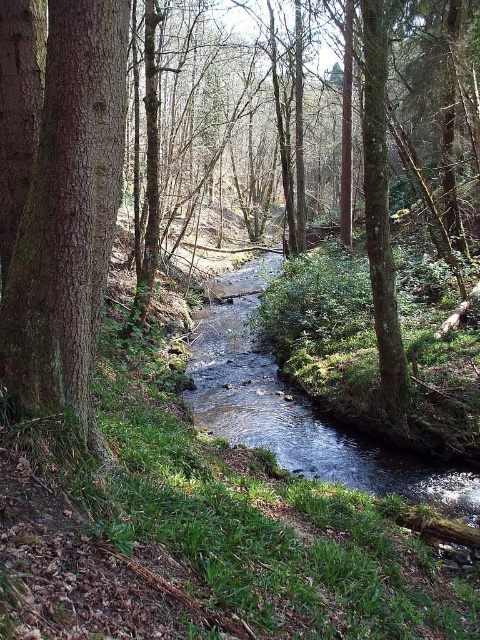
Does smooth brown tree trunk at left lie in front of clear water at center?

Yes, smooth brown tree trunk at left is in front of clear water at center.

Can you confirm if smooth brown tree trunk at left is bigger than clear water at center?

No, smooth brown tree trunk at left is not bigger than clear water at center.

Which is behind, point (84, 196) or point (261, 417)?

Point (261, 417)

Where is `smooth brown tree trunk at left`? The width and height of the screenshot is (480, 640). smooth brown tree trunk at left is located at coordinates (68, 216).

Is brown rough tree at center further to camera compared to smooth brown tree trunk at left?

Yes, it is.

Locate an element on the screen. brown rough tree at center is located at coordinates (62, 205).

Is brown rough tree at center further to camera compared to clear water at center?

No.

Who is positioned more to the right, brown rough tree at center or clear water at center?

clear water at center

Is point (62, 410) closer to viewer compared to point (296, 412)?

Yes, it is in front of point (296, 412).

This screenshot has width=480, height=640. What are the coordinates of `brown rough tree at center` in the screenshot? It's located at (62, 205).